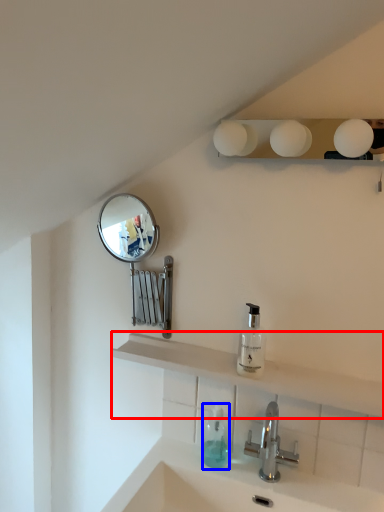
Question: Which of the following is the farthest to the observer, shelve (highlighted by a red box) or soap dispenser (highlighted by a blue box)?

Choices:
 (A) shelve
 (B) soap dispenser

Answer: (B)